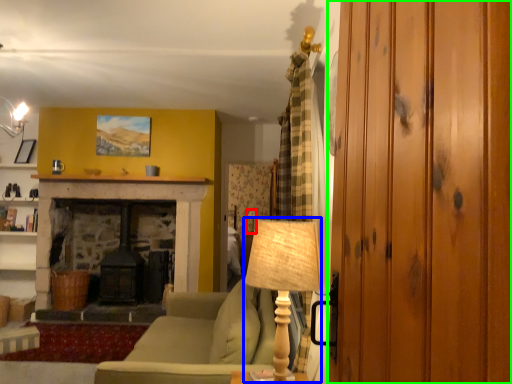
Question: Which object is the farthest from table lamp (highlighted by a red box)? Choose among these: table lamp (highlighted by a blue box) or glass door (highlighted by a green box).

Choices:
 (A) table lamp
 (B) glass door

Answer: (B)